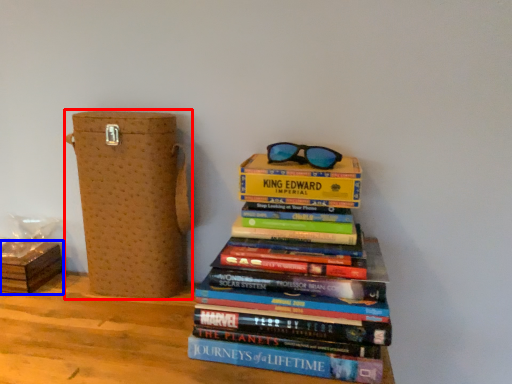
Question: Which object is further to the camera taking this photo, cardboard box (highlighted by a red box) or cardboard box (highlighted by a blue box)?

Choices:
 (A) cardboard box
 (B) cardboard box

Answer: (B)